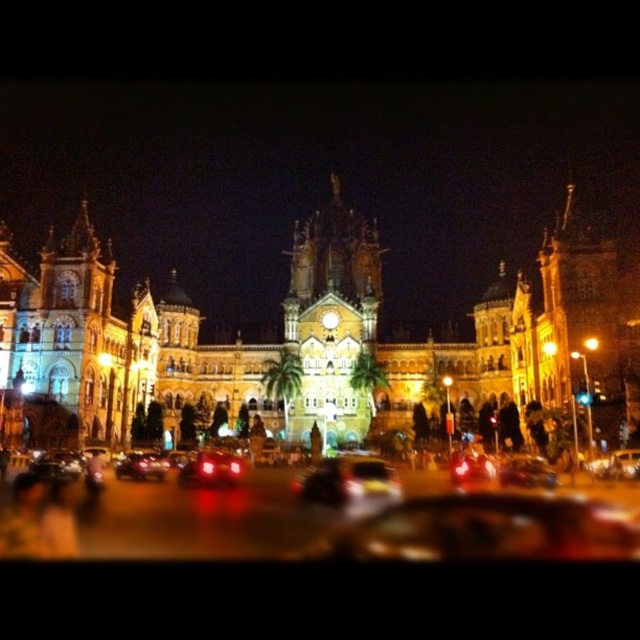
Question: Which of the following is the closest to the observer?

Choices:
 (A) shiny red car at center
 (B) shiny black car at center
 (C) matte black car at center

Answer: (B)

Question: Can you confirm if matte black car at center is positioned to the right of shiny red car at center?

Choices:
 (A) yes
 (B) no

Answer: (A)

Question: Estimate the real-world distances between objects in this image. Which object is closer to the shiny red car at center?

Choices:
 (A) matte black car at center
 (B) yellow stone building at center
 (C) shiny black car at center

Answer: (A)

Question: Is yellow stone building at center to the right of shiny red car at center from the viewer's perspective?

Choices:
 (A) no
 (B) yes

Answer: (B)

Question: Is matte black car at center to the left of shiny red car at center from the viewer's perspective?

Choices:
 (A) no
 (B) yes

Answer: (A)

Question: Which object is positioned farthest from the matte black car at center?

Choices:
 (A) yellow stone building at center
 (B) shiny black car at center
 (C) shiny red car at center

Answer: (B)